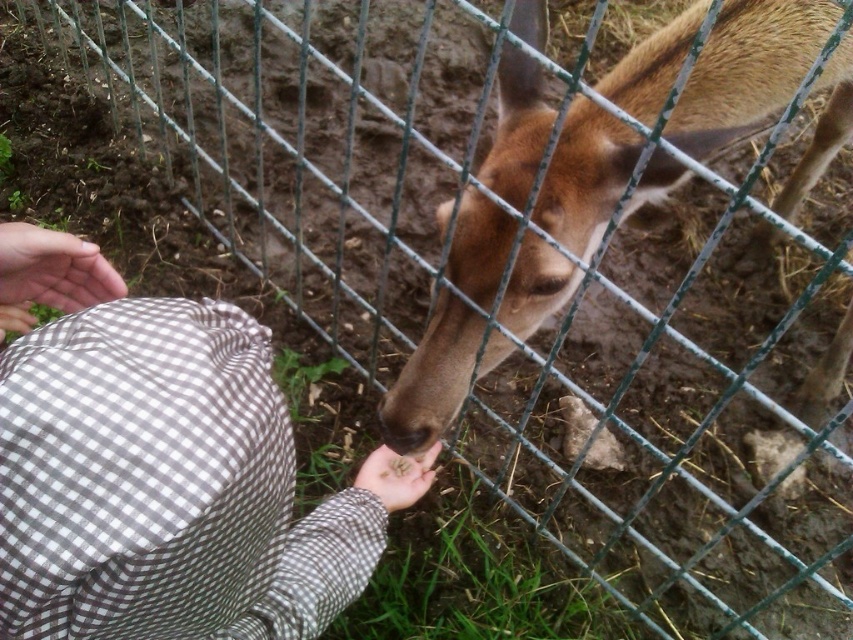
Does brown checkered shirt at lower left come behind smooth fabric hand at lower left?

No.

Does brown checkered shirt at lower left appear under smooth fabric hand at lower left?

Yes, brown checkered shirt at lower left is below smooth fabric hand at lower left.

Describe the element at coordinates (154, 468) in the screenshot. I see `brown checkered shirt at lower left` at that location.

The image size is (853, 640). Identify the location of brown checkered shirt at lower left. (154, 468).

Can you confirm if brown checkered shirt at lower left is shorter than smooth brown hand at lower center?

In fact, brown checkered shirt at lower left may be taller than smooth brown hand at lower center.

Does point (22, 452) come behind point (357, 476)?

No, (22, 452) is in front of (357, 476).

At what (x,y) coordinates should I click in order to perform the action: click on brown checkered shirt at lower left. Please return your answer as a coordinate pair (x, y). The image size is (853, 640). Looking at the image, I should click on (154, 468).

Does smooth fabric hand at lower left appear on the left side of smooth brown hand at lower center?

Indeed, smooth fabric hand at lower left is positioned on the left side of smooth brown hand at lower center.

Is smooth fabric hand at lower left positioned at the back of smooth brown hand at lower center?

No, it is not.

Find the location of a particular element. smooth fabric hand at lower left is located at coordinates (49, 275).